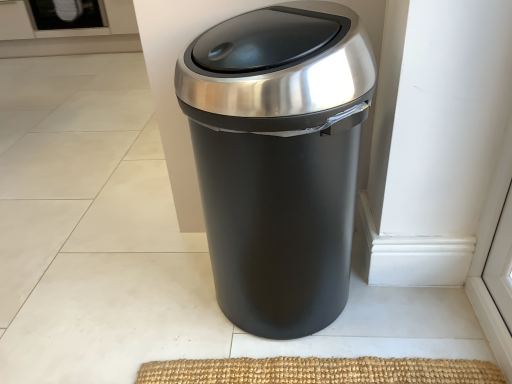
Question: Is the position of black glass screen door at upper left more distant than that of matte black trash can at center?

Choices:
 (A) no
 (B) yes

Answer: (B)

Question: Is black glass screen door at upper left not close to matte black trash can at center?

Choices:
 (A) yes
 (B) no

Answer: (A)

Question: Is matte black trash can at center at the back of black glass screen door at upper left?

Choices:
 (A) yes
 (B) no

Answer: (B)

Question: From the image's perspective, would you say black glass screen door at upper left is positioned over matte black trash can at center?

Choices:
 (A) no
 (B) yes

Answer: (B)

Question: From a real-world perspective, is black glass screen door at upper left below matte black trash can at center?

Choices:
 (A) no
 (B) yes

Answer: (B)

Question: Does black glass screen door at upper left turn towards matte black trash can at center?

Choices:
 (A) yes
 (B) no

Answer: (B)

Question: Considering the relative sizes of matte black trash can at center and black glass screen door at upper left in the image provided, is matte black trash can at center taller than black glass screen door at upper left?

Choices:
 (A) yes
 (B) no

Answer: (A)

Question: From the image's perspective, is matte black trash can at center over black glass screen door at upper left?

Choices:
 (A) yes
 (B) no

Answer: (B)

Question: Is matte black trash can at center placed right next to black glass screen door at upper left?

Choices:
 (A) yes
 (B) no

Answer: (B)

Question: From a real-world perspective, is matte black trash can at center positioned under black glass screen door at upper left based on gravity?

Choices:
 (A) no
 (B) yes

Answer: (A)

Question: Considering the relative positions of matte black trash can at center and black glass screen door at upper left in the image provided, is matte black trash can at center behind black glass screen door at upper left?

Choices:
 (A) no
 (B) yes

Answer: (A)

Question: From the image's perspective, does matte black trash can at center appear lower than black glass screen door at upper left?

Choices:
 (A) yes
 (B) no

Answer: (A)

Question: Relative to matte black trash can at center, is black glass screen door at upper left in front or behind?

Choices:
 (A) behind
 (B) front

Answer: (A)